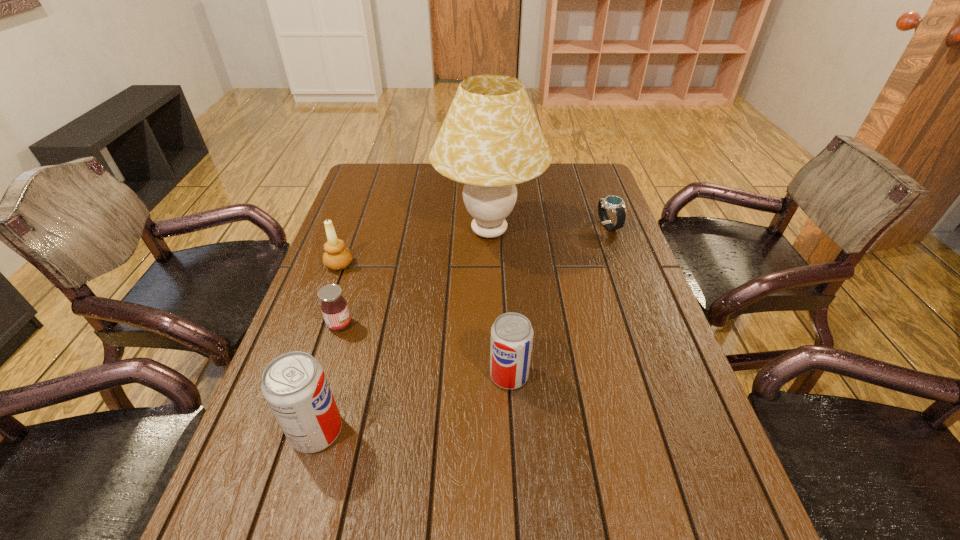
The image size is (960, 540). What are the coordinates of `free space in the image that satisfies the following two spatial constraints: 1. on the front side of the tallest object; 2. on the label side of the jam` in the screenshot? It's located at pos(492,325).

Where is `free spot that satisfies the following two spatial constraints: 1. on the back side of the watch; 2. on the right side of the candle_holder`? Image resolution: width=960 pixels, height=540 pixels. free spot that satisfies the following two spatial constraints: 1. on the back side of the watch; 2. on the right side of the candle_holder is located at coordinates (353, 226).